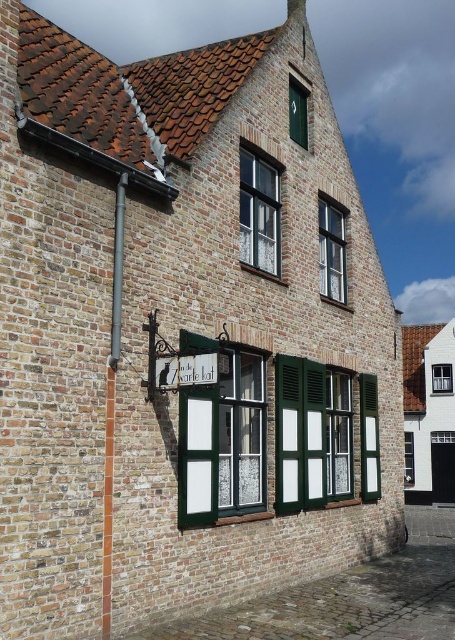
Question: Which object appears closest to the camera in this image?

Choices:
 (A) white wooden window at upper center
 (B) clear glass window at upper center
 (C) white lace curtain at upper center

Answer: (C)

Question: Can you confirm if white lace curtain at upper center is thinner than green matte window at upper center?

Choices:
 (A) yes
 (B) no

Answer: (B)

Question: Does white lace curtain at upper center appear on the left side of green matte window at upper center?

Choices:
 (A) yes
 (B) no

Answer: (A)

Question: Which object appears farthest from the camera in this image?

Choices:
 (A) clear glass window at center
 (B) white painted wood window at center
 (C) white wooden window at upper center

Answer: (C)

Question: Which object appears closest to the camera in this image?

Choices:
 (A) clear glass window at upper center
 (B) green matte shutter at lower center

Answer: (A)

Question: From the image, what is the correct spatial relationship of white painted wood window at center in relation to white lace curtain at upper center?

Choices:
 (A) right
 (B) left

Answer: (B)